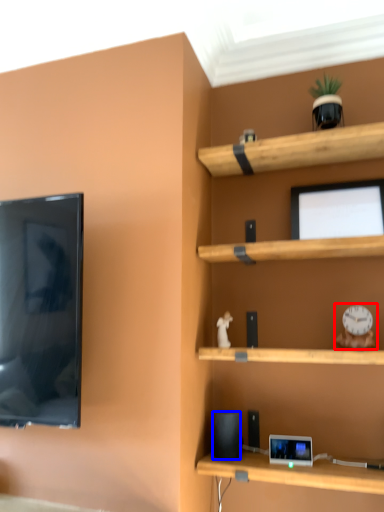
Question: Which of the following is the farthest to the observer, toy (highlighted by a red box) or speaker (highlighted by a blue box)?

Choices:
 (A) toy
 (B) speaker

Answer: (B)